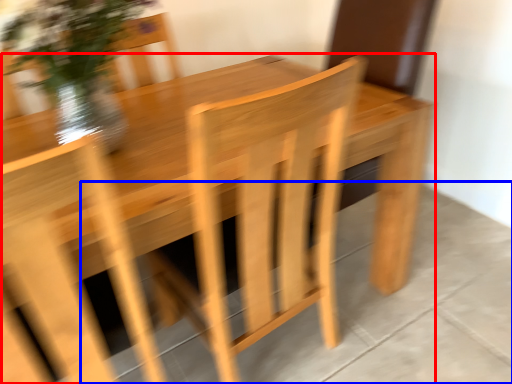
Question: Which object appears farthest to the camera in this image, table (highlighted by a red box) or concrete (highlighted by a blue box)?

Choices:
 (A) table
 (B) concrete

Answer: (B)